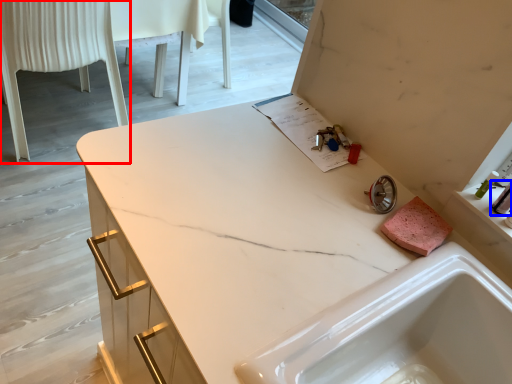
Question: Which object appears closest to the camera in this image, chair (highlighted by a red box) or toiletry (highlighted by a blue box)?

Choices:
 (A) chair
 (B) toiletry

Answer: (B)